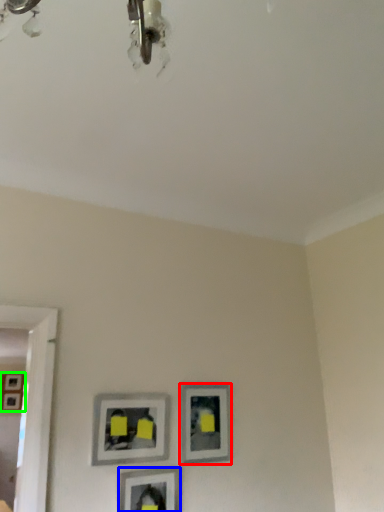
Question: Based on their relative distances, which object is farther from picture frame (highlighted by a red box)? Choose from picture frame (highlighted by a blue box) and picture frame (highlighted by a green box).

Choices:
 (A) picture frame
 (B) picture frame

Answer: (B)